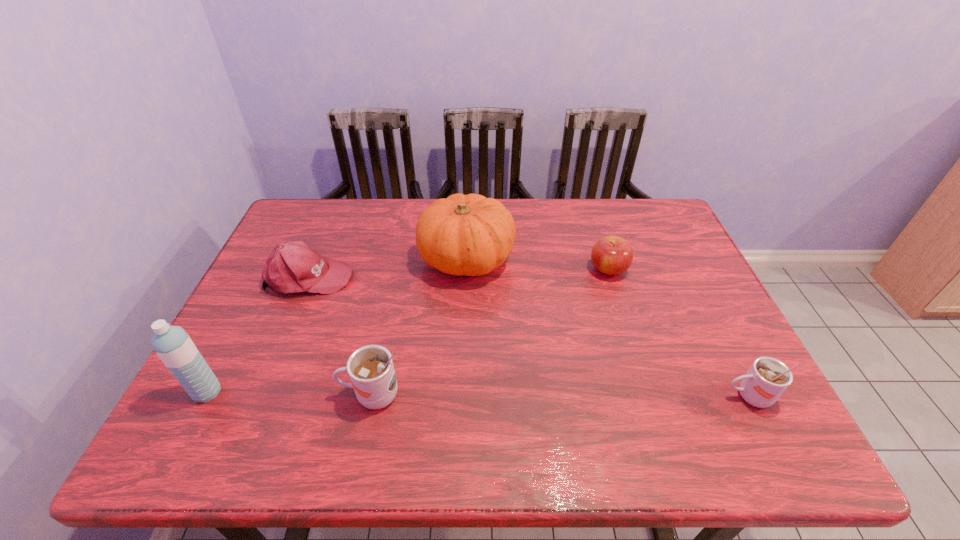
Image resolution: width=960 pixels, height=540 pixels. What are the coordinates of `the taller cup` in the screenshot? It's located at point(371,370).

Find the location of `the left cup`. the left cup is located at coordinates (371, 370).

The image size is (960, 540). In order to click on the rightmost object in this screenshot , I will do (x=767, y=379).

Identify the location of the right cup. (767, 379).

In order to click on pumpkin in this screenshot , I will do `click(471, 235)`.

You are a GUI agent. You are given a task and a screenshot of the screen. Output one action in this format:
    pyautogui.click(x=<x>, y=<y>)
    Task: Click on the baseball cap
    Image resolution: width=960 pixels, height=540 pixels.
    Given the screenshot: What is the action you would take?
    pyautogui.click(x=293, y=267)

The height and width of the screenshot is (540, 960). What are the coordinates of `apple` in the screenshot? It's located at (611, 255).

The height and width of the screenshot is (540, 960). What are the coordinates of `water bottle` in the screenshot? It's located at (172, 344).

Find the location of `vacant region located on the side with the handle of the fourth shortest object`. vacant region located on the side with the handle of the fourth shortest object is located at coordinates (258, 395).

This screenshot has width=960, height=540. In order to click on free space located 0.200m on the side with the handle of the fourth shortest object in this screenshot , I will do `click(249, 395)`.